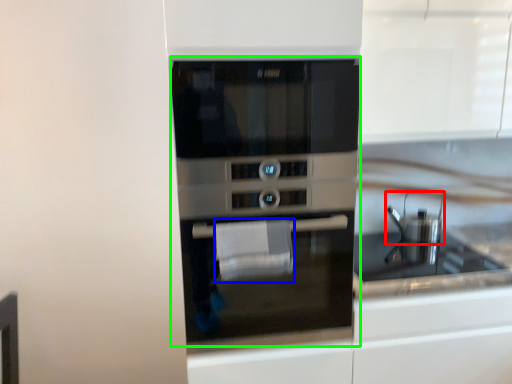
Question: Which object is the farthest from appliance (highlighted by a red box)? Choose among these: hand towel (highlighted by a blue box) or oven (highlighted by a green box).

Choices:
 (A) hand towel
 (B) oven

Answer: (A)